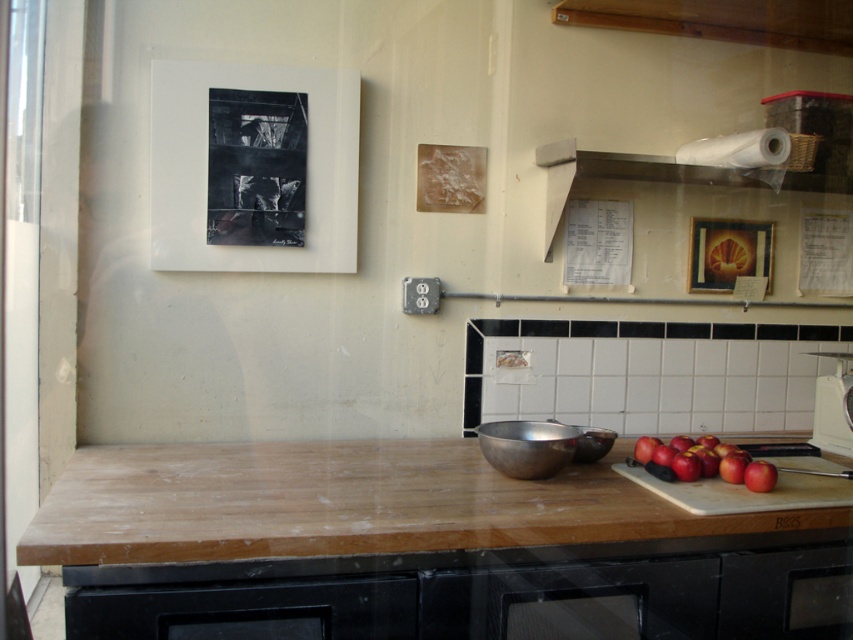
You are standing at the point marked as point (706, 461) in the kitchen. What object are you closest to?

You are closest to the red matte apples at lower right because the point (706, 461) corresponds to their location.

You are organizing the kitchen and need to place a new spice jar between the wooden cutting board at center and the white matte paper towel at upper right. Based on their positions, where should you place the spice jar?

The wooden cutting board at center is to the left of the white matte paper towel at upper right, so you should place the spice jar between them, to the right of the wooden cutting board at center and to the left of the white matte paper towel at upper right.

You are a chef standing at the counter and want to weigh an apple using the white glossy scale at right. Can you reach it without moving from your current position?

The white glossy scale at right is 1.73 meters away from camera, so if the chef is standing at the counter, they might need to move closer to reach it since it is 1.73 meters away.